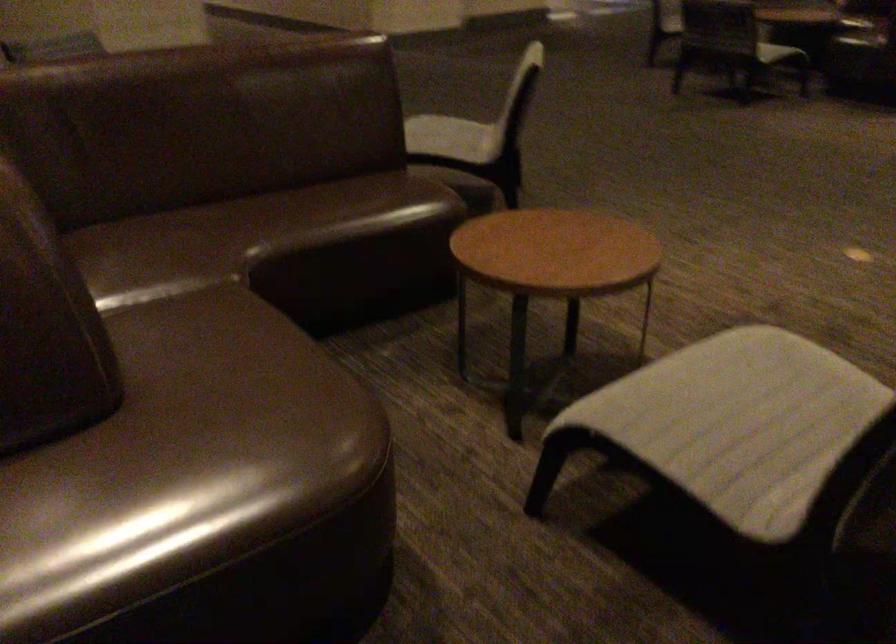
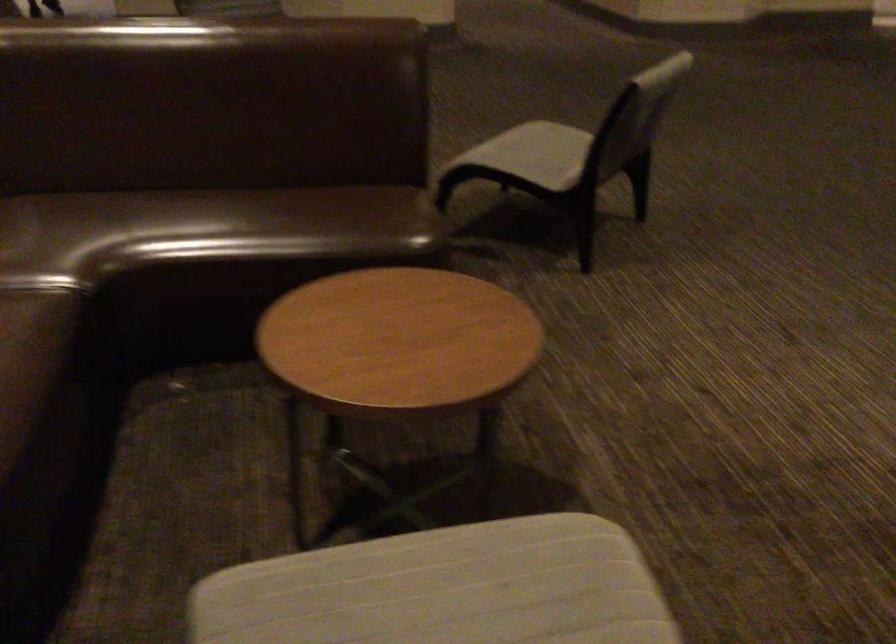
The images are taken continuously from a first-person perspective. In which direction are you moving?

The movement direction of the cameraman is right, forward.